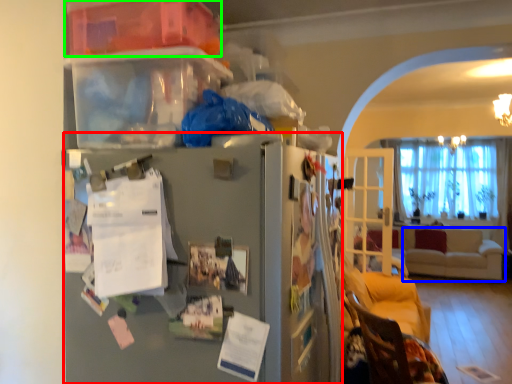
Question: Estimate the real-world distances between objects in this image. Which object is closer to fridge (highlighted by a red box), studio couch (highlighted by a blue box) or storage box (highlighted by a green box)?

Choices:
 (A) studio couch
 (B) storage box

Answer: (B)